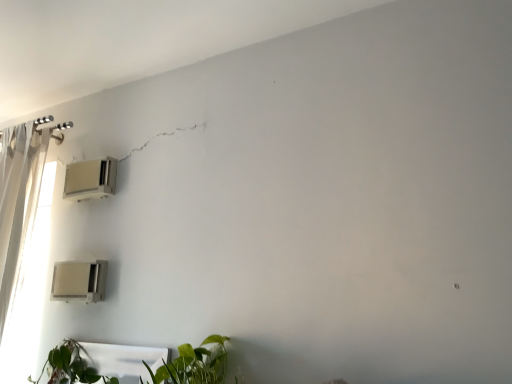
Question: Is white plastic air conditioner at upper left, the 1th air conditioning positioned from the top, smaller than green leafy plant at lower center?

Choices:
 (A) no
 (B) yes

Answer: (B)

Question: From a real-world perspective, is white plastic air conditioner at upper left, the 1th air conditioning positioned from the top, physically above green leafy plant at lower center?

Choices:
 (A) yes
 (B) no

Answer: (A)

Question: Can you confirm if white plastic air conditioner at upper left, acting as the 2th air conditioning starting from the bottom, is bigger than green leafy plant at lower center?

Choices:
 (A) no
 (B) yes

Answer: (A)

Question: Is white plastic air conditioner at upper left, the 1th air conditioning positioned from the top, positioned behind green leafy plant at lower center?

Choices:
 (A) no
 (B) yes

Answer: (B)

Question: From a real-world perspective, is white plastic air conditioner at upper left, acting as the 2th air conditioning starting from the bottom, beneath green leafy plant at lower center?

Choices:
 (A) no
 (B) yes

Answer: (A)

Question: Considering the positions of green leafy plant at lower center and beige plastic air conditioner at lower left, arranged as the 1th air conditioning when ordered from the bottom, in the image, is green leafy plant at lower center taller or shorter than beige plastic air conditioner at lower left, arranged as the 1th air conditioning when ordered from the bottom,?

Choices:
 (A) short
 (B) tall

Answer: (A)

Question: In terms of size, does green leafy plant at lower center appear bigger or smaller than beige plastic air conditioner at lower left, the 2th air conditioning positioned from the top?

Choices:
 (A) big
 (B) small

Answer: (A)

Question: Considering the relative positions of green leafy plant at lower center and beige plastic air conditioner at lower left, the 2th air conditioning positioned from the top, in the image provided, is green leafy plant at lower center to the left or to the right of beige plastic air conditioner at lower left, the 2th air conditioning positioned from the top,?

Choices:
 (A) left
 (B) right

Answer: (B)

Question: From a real-world perspective, is green leafy plant at lower center physically located above or below beige plastic air conditioner at lower left, the 2th air conditioning positioned from the top?

Choices:
 (A) below
 (B) above

Answer: (A)

Question: Looking at their shapes, would you say beige plastic air conditioner at lower left, the 2th air conditioning positioned from the top, is wider or thinner than green leafy plant at lower center?

Choices:
 (A) wide
 (B) thin

Answer: (B)

Question: From their relative heights in the image, would you say beige plastic air conditioner at lower left, the 2th air conditioning positioned from the top, is taller or shorter than green leafy plant at lower center?

Choices:
 (A) tall
 (B) short

Answer: (A)

Question: Considering the positions of beige plastic air conditioner at lower left, arranged as the 1th air conditioning when ordered from the bottom, and green leafy plant at lower center in the image, is beige plastic air conditioner at lower left, arranged as the 1th air conditioning when ordered from the bottom, bigger or smaller than green leafy plant at lower center?

Choices:
 (A) big
 (B) small

Answer: (B)

Question: Is beige plastic air conditioner at lower left, the 2th air conditioning positioned from the top, in front of or behind green leafy plant at lower center in the image?

Choices:
 (A) behind
 (B) front

Answer: (A)

Question: Does point (162, 362) appear closer or farther from the camera than point (79, 173)?

Choices:
 (A) closer
 (B) farther

Answer: (A)

Question: From their relative heights in the image, would you say green leafy plant at lower center is taller or shorter than white plastic air conditioner at upper left, acting as the 2th air conditioning starting from the bottom?

Choices:
 (A) short
 (B) tall

Answer: (A)